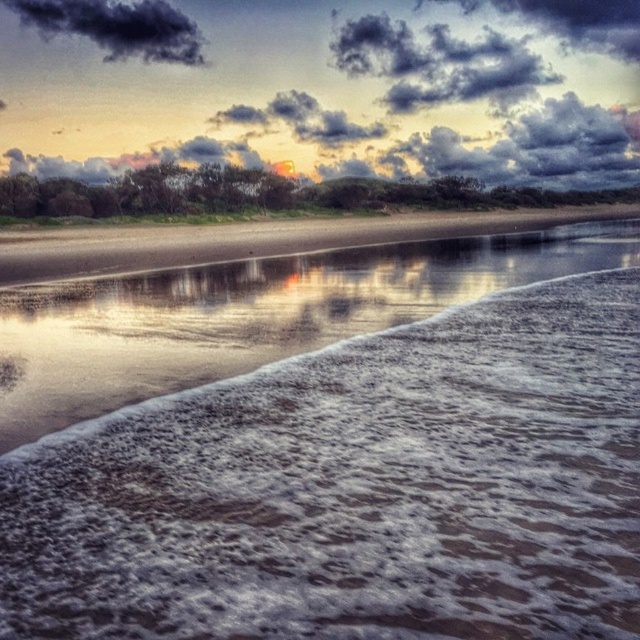
Is dark textured cloud at upper center behind dark gray fluffy cloud at upper left?

No, it is not.

What do you see at coordinates (438, 64) in the screenshot? I see `dark textured cloud at upper center` at bounding box center [438, 64].

Is point (472, 54) more distant than point (99, 44)?

Yes, point (472, 54) is behind point (99, 44).

The image size is (640, 640). I want to click on dark textured cloud at upper center, so click(x=438, y=64).

Who is taller, dark gray fluffy cloud at upper left or dark gray fluffy cloud at upper center?

Standing taller between the two is dark gray fluffy cloud at upper left.

Find the location of a particular element. The image size is (640, 640). dark gray fluffy cloud at upper left is located at coordinates (118, 26).

Is point (188, 356) more distant than point (349, 36)?

No, it is in front of (349, 36).

Is white frothy water at lower left bigger than dark textured cloud at upper center?

Indeed, white frothy water at lower left has a larger size compared to dark textured cloud at upper center.

Is point (324, 275) behind point (465, 65)?

No.

At what (x,y) coordinates should I click in order to perform the action: click on white frothy water at lower left. Please return your answer as a coordinate pair (x, y). The height and width of the screenshot is (640, 640). Looking at the image, I should click on (250, 314).